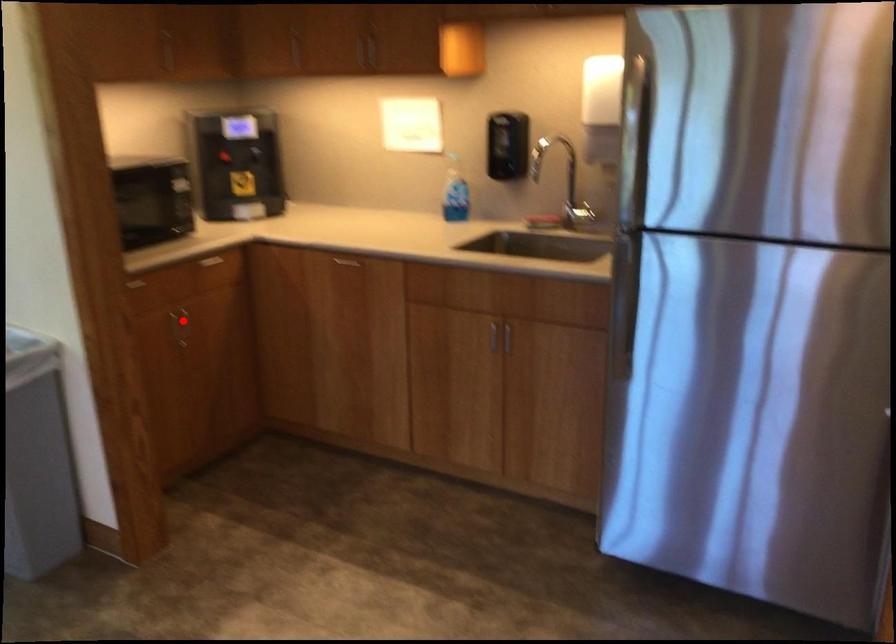
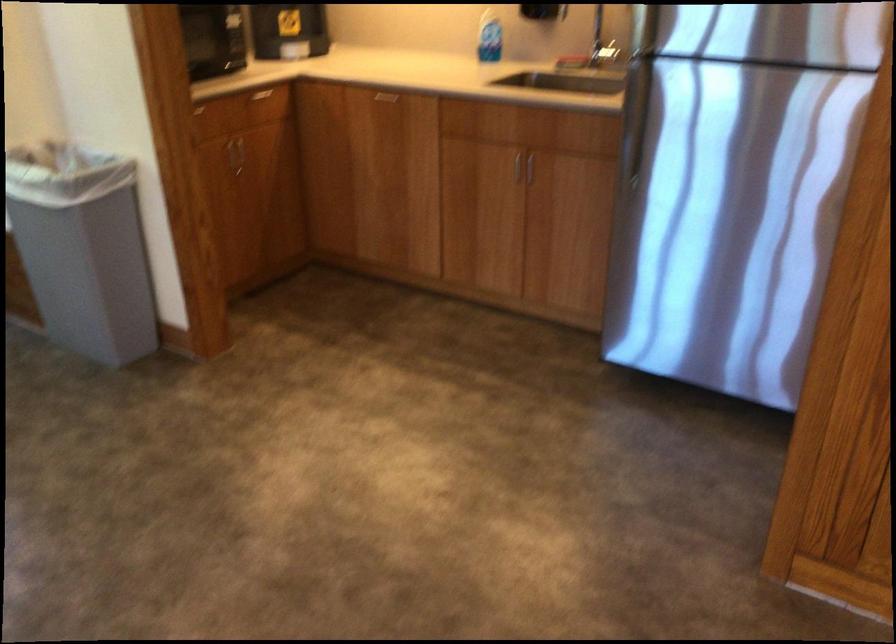
Question: I am providing you with two images of the same scene from different viewpoints. A red point is marked on the first image. Can you still see the location of the red point in image 2?

Choices:
 (A) Yes
 (B) No

Answer: (A)